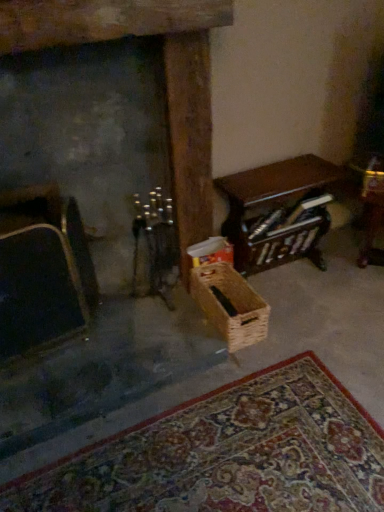
Question: Should I look upward or downward to see dark gray stone fireplace at left?

Choices:
 (A) down
 (B) up

Answer: (B)

Question: Can you confirm if wooden table at right is shorter than woven brown basket at center?

Choices:
 (A) no
 (B) yes

Answer: (A)

Question: Is wooden table at right at the left side of woven brown basket at center?

Choices:
 (A) no
 (B) yes

Answer: (A)

Question: Does wooden table at right have a larger size compared to woven brown basket at center?

Choices:
 (A) no
 (B) yes

Answer: (B)

Question: Is woven brown basket at center inside wooden table at right?

Choices:
 (A) no
 (B) yes

Answer: (A)

Question: Does wooden table at right touch woven brown basket at center?

Choices:
 (A) no
 (B) yes

Answer: (A)

Question: Can you confirm if wooden table at right is wider than woven brown basket at center?

Choices:
 (A) yes
 (B) no

Answer: (B)

Question: From a real-world perspective, is wooden table at right over dark gray stone fireplace at left?

Choices:
 (A) yes
 (B) no

Answer: (B)

Question: Can you confirm if wooden table at right is positioned to the left of dark gray stone fireplace at left?

Choices:
 (A) yes
 (B) no

Answer: (B)

Question: From the image's perspective, is wooden table at right above dark gray stone fireplace at left?

Choices:
 (A) yes
 (B) no

Answer: (B)

Question: Considering the relative positions of wooden table at right and dark gray stone fireplace at left in the image provided, is wooden table at right in front of dark gray stone fireplace at left?

Choices:
 (A) no
 (B) yes

Answer: (A)

Question: Are wooden table at right and dark gray stone fireplace at left located far from each other?

Choices:
 (A) yes
 (B) no

Answer: (B)

Question: Considering the relative sizes of wooden table at right and dark gray stone fireplace at left in the image provided, is wooden table at right taller than dark gray stone fireplace at left?

Choices:
 (A) yes
 (B) no

Answer: (B)

Question: Does woven brown basket at center have a greater width compared to velvet black armchair at left?

Choices:
 (A) no
 (B) yes

Answer: (B)